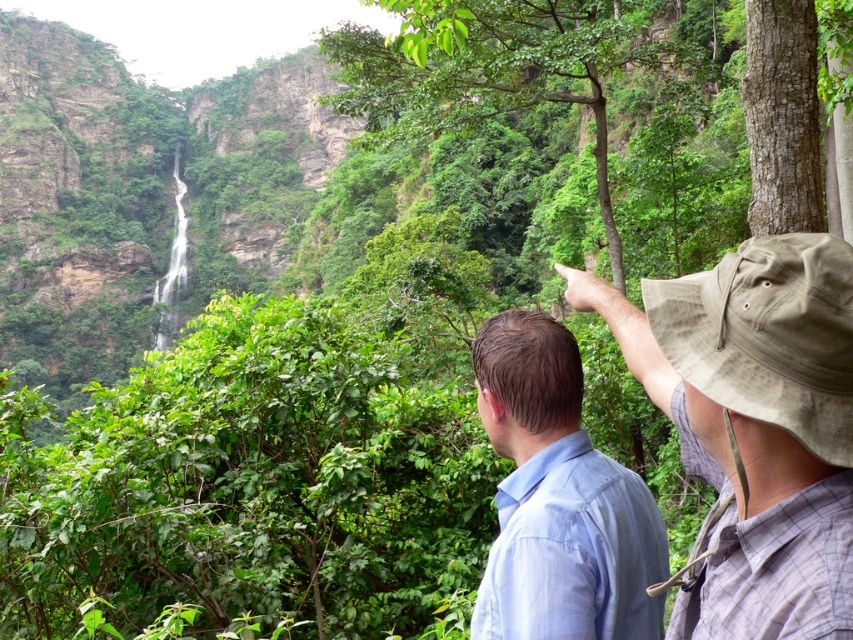
Does point (776, 321) come in front of point (432, 115)?

Yes, it is.

Which is in front, point (753, 456) or point (410, 24)?

Point (753, 456) is in front.

Where is `khaki canvas hat at upper right`? khaki canvas hat at upper right is located at coordinates (753, 426).

Who is taller, green leafy tree at upper center or brown rough bark tree at upper right?

Standing taller between the two is green leafy tree at upper center.

Does green leafy tree at upper center have a lesser width compared to brown rough bark tree at upper right?

In fact, green leafy tree at upper center might be wider than brown rough bark tree at upper right.

Describe the element at coordinates (503, 68) in the screenshot. I see `green leafy tree at upper center` at that location.

Locate an element on the screen. Image resolution: width=853 pixels, height=640 pixels. green leafy tree at upper center is located at coordinates (503, 68).

Can you confirm if light blue shirt at center is positioned to the right of green leafy tree at upper center?

Incorrect, light blue shirt at center is not on the right side of green leafy tree at upper center.

Can you confirm if light blue shirt at center is positioned above green leafy tree at upper center?

Incorrect, light blue shirt at center is not positioned above green leafy tree at upper center.

Identify the location of light blue shirt at center. (558, 499).